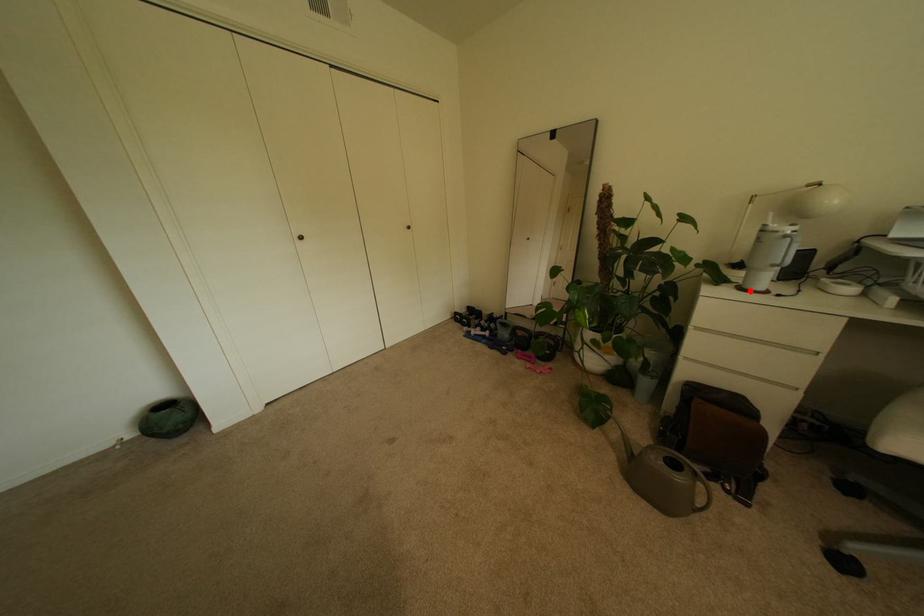
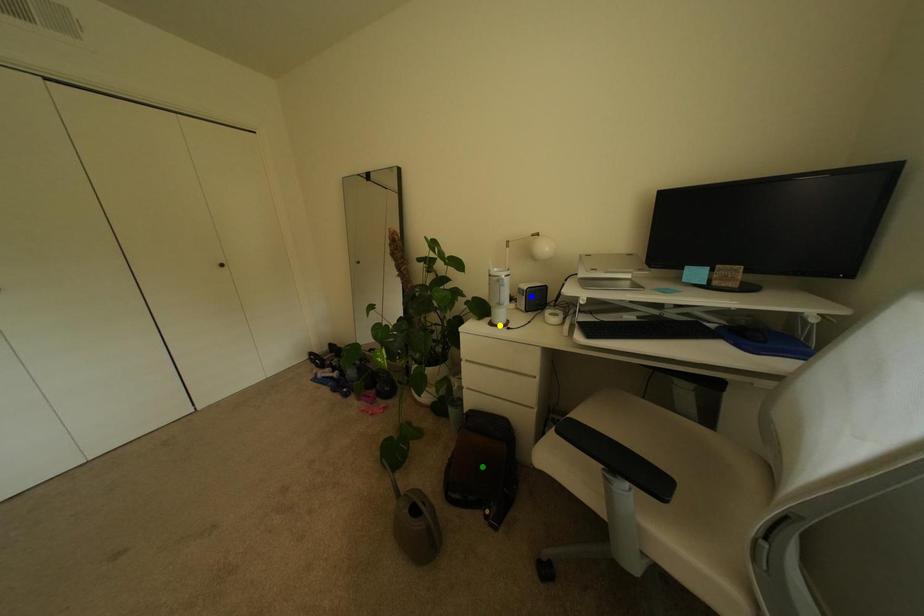
Question: I am providing you with two images of the same scene from different viewpoints. A red point is marked on the first image. You are given multiple points on the second image. Can you choose the point in image 2 that corresponds to the point in image 1?

Choices:
 (A) blue point
 (B) yellow point
 (C) green point

Answer: (B)